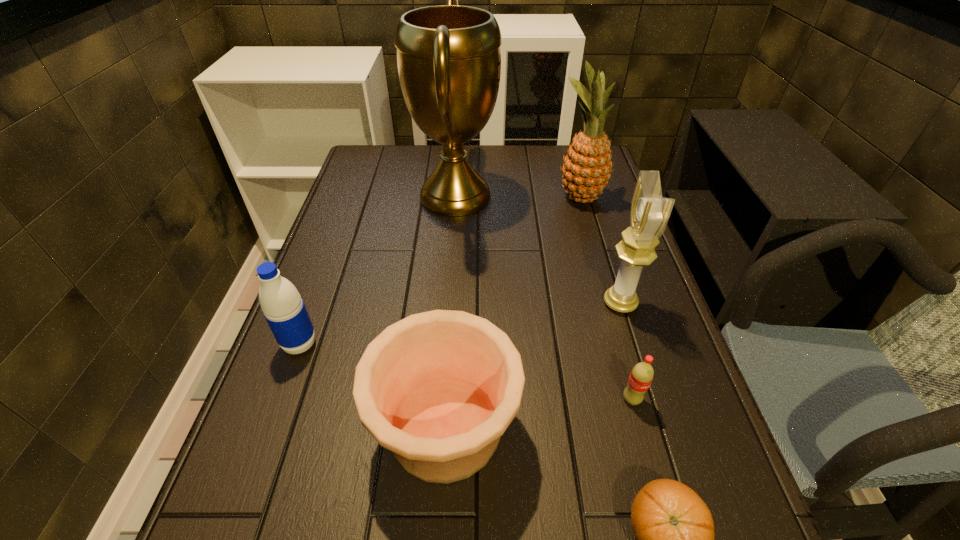
You are a GUI agent. You are given a task and a screenshot of the screen. Output one action in this format:
    pyautogui.click(x=<x>, y=<y>)
    Task: Click on the soda that is at the right edge
    This screenshot has height=540, width=960.
    Given the screenshot: What is the action you would take?
    pyautogui.click(x=642, y=374)

This screenshot has height=540, width=960. What are the coordinates of `free space at the left edge of the desktop` in the screenshot? It's located at (326, 453).

The width and height of the screenshot is (960, 540). Find the location of `free point at the right edge`. free point at the right edge is located at coordinates (669, 414).

The width and height of the screenshot is (960, 540). In order to click on free spot between the second tallest object and the fourth nearest object in this screenshot , I will do `click(441, 271)`.

Locate an element on the screen. This screenshot has width=960, height=540. vacant space in between the fifth tallest object and the third tallest object is located at coordinates (533, 365).

Locate an element on the screen. free area in between the sixth shortest object and the fourth tallest object is located at coordinates (441, 271).

The image size is (960, 540). Find the location of `free space between the third tallest object and the pineapple`. free space between the third tallest object and the pineapple is located at coordinates (x=600, y=251).

Identify the location of free space between the third tallest object and the soda. This screenshot has width=960, height=540. (626, 351).

Locate which object ranks third in proximity to the pottery. Please provide its 2D coordinates. Your answer should be formatted as a tuple, i.e. [(x, y)], where the tuple contains the x and y coordinates of a point satisfying the conditions above.

[(642, 374)]

Identify which object is the second closest to the shortest object. Please provide its 2D coordinates. Your answer should be formatted as a tuple, i.e. [(x, y)], where the tuple contains the x and y coordinates of a point satisfying the conditions above.

[(642, 374)]